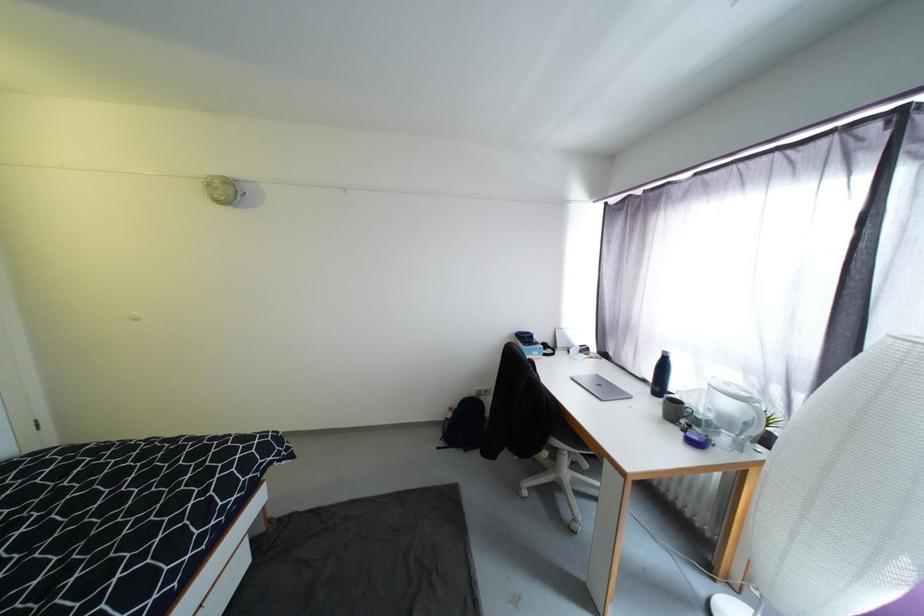
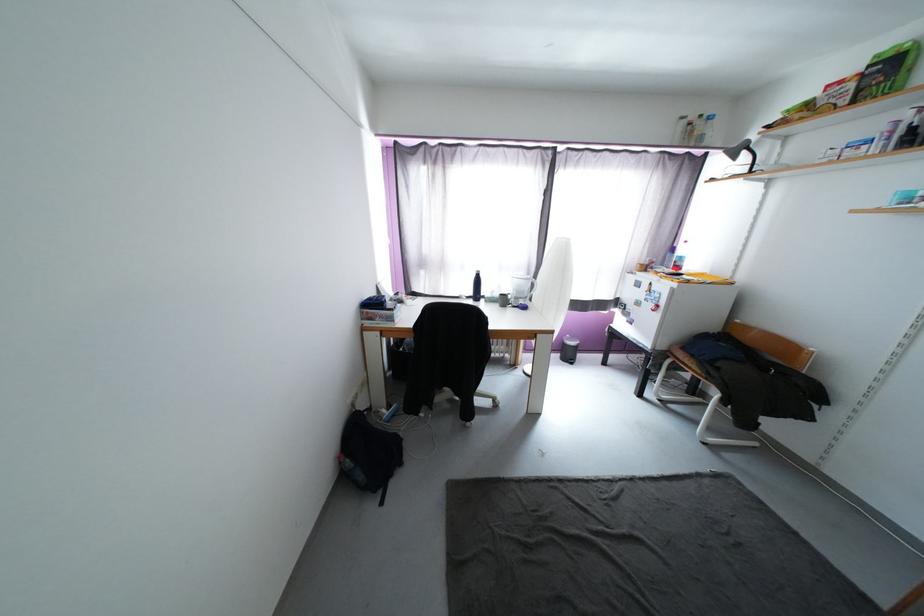
Where in the second image is the point corresponding to [452,428] from the first image?

(367, 479)